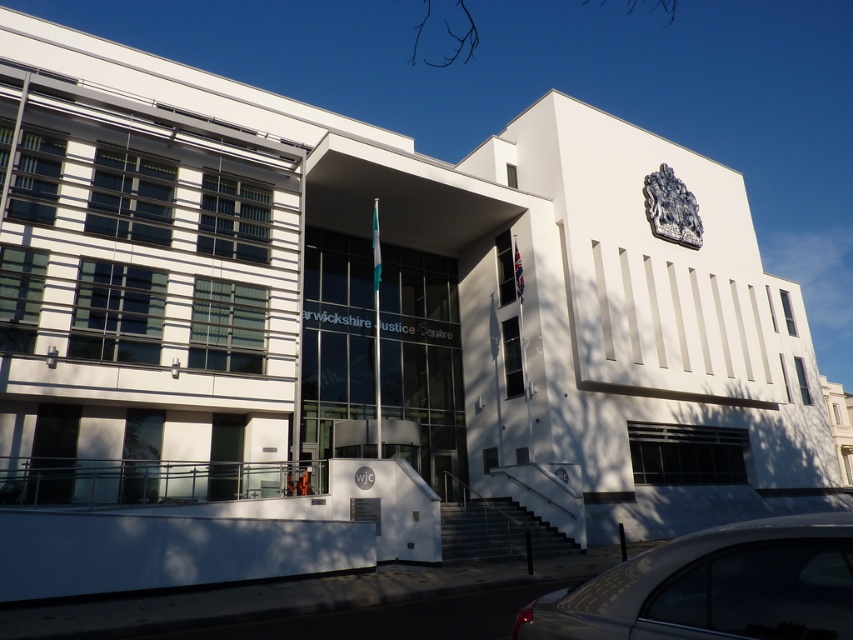
Question: Is silver metallic car at lower right behind silver metallic emblem at upper center?

Choices:
 (A) yes
 (B) no

Answer: (B)

Question: Can you confirm if silver metallic car at lower right is positioned to the left of silver metallic emblem at upper center?

Choices:
 (A) no
 (B) yes

Answer: (B)

Question: Which point is farther to the camera?

Choices:
 (A) (654, 227)
 (B) (766, 518)

Answer: (A)

Question: Observing the image, what is the correct spatial positioning of silver metallic car at lower right in reference to silver metallic emblem at upper center?

Choices:
 (A) below
 (B) above

Answer: (A)